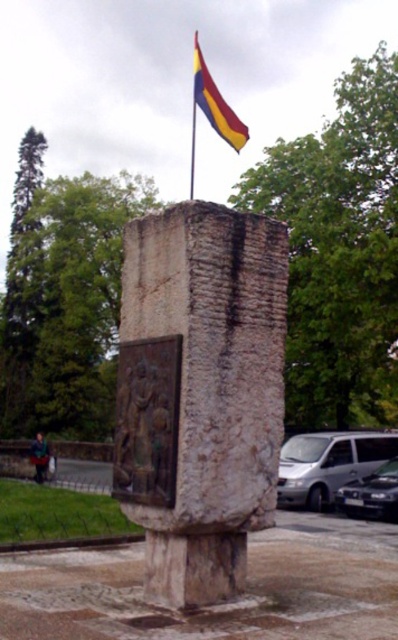
You are standing in front of the stone monument and want to hang a new flag. The flag you have is slightly smaller than the existing yellow and red striped flag at upper center. Can you determine if the metallic flag pole at upper center can accommodate your new flag?

The yellow and red striped flag at upper center is above the metallic flag pole at upper center, which means the pole is already holding the existing flag. Since your new flag is smaller, it might fit, but you need to ensure there is enough space on the pole to attach it without interfering with the existing flag.

You are standing in front of the white stone monument at center and looking towards the yellow and red striped flag at upper center. Is the flag behind or in front of the monument?

The white stone monument at center is in front of the yellow and red striped flag at upper center, so the flag is behind the monument.

You are standing in front of the monument and want to place a small flower pot at the base of the monument. If you look up from the flower pot, will the metallic flag pole at upper center be above or below the white stone monument at center?

The metallic flag pole at upper center is above the white stone monument at center, so when looking up from the flower pot at the base, the flag pole will be above the monument.